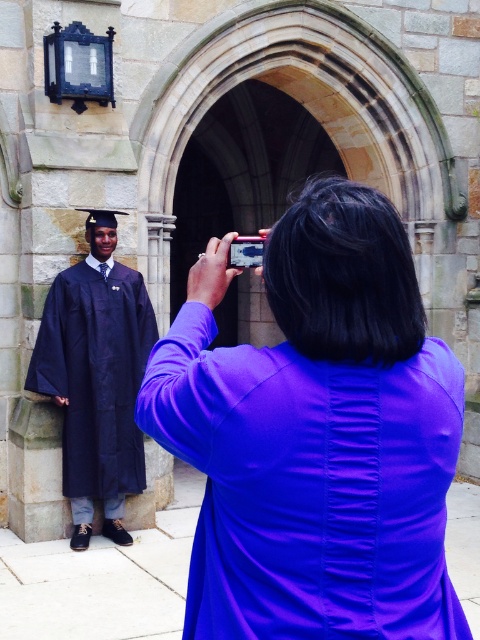
Question: Which object is farther from the camera taking this photo?

Choices:
 (A) matte black gown at left
 (B) purple satin dress at center

Answer: (A)

Question: In this image, where is purple satin dress at center located relative to matte black gown at left?

Choices:
 (A) right
 (B) left

Answer: (A)

Question: Is purple satin dress at center above matte black gown at left?

Choices:
 (A) yes
 (B) no

Answer: (A)

Question: Is purple satin dress at center positioned in front of matte black gown at left?

Choices:
 (A) no
 (B) yes

Answer: (B)

Question: Which of the following is the closest to the observer?

Choices:
 (A) purple satin dress at center
 (B) matte black gown at left

Answer: (A)